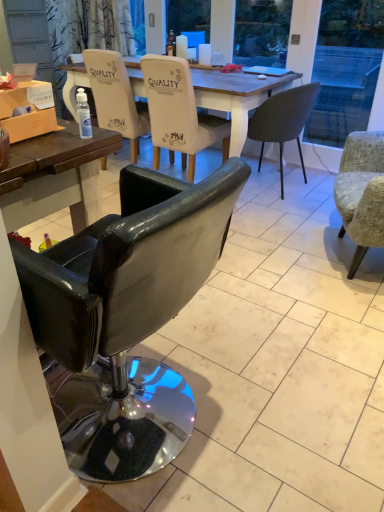
Locate an element on the screen. vacant region to the right of black leather chair at lower left, acting as the 1th chair starting from the front is located at coordinates (275, 410).